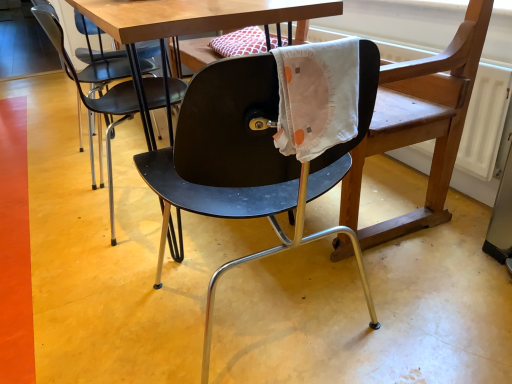
Locate an element on the screen. vacant space to the left of matte black chair at center, the second chair viewed from the left is located at coordinates (103, 304).